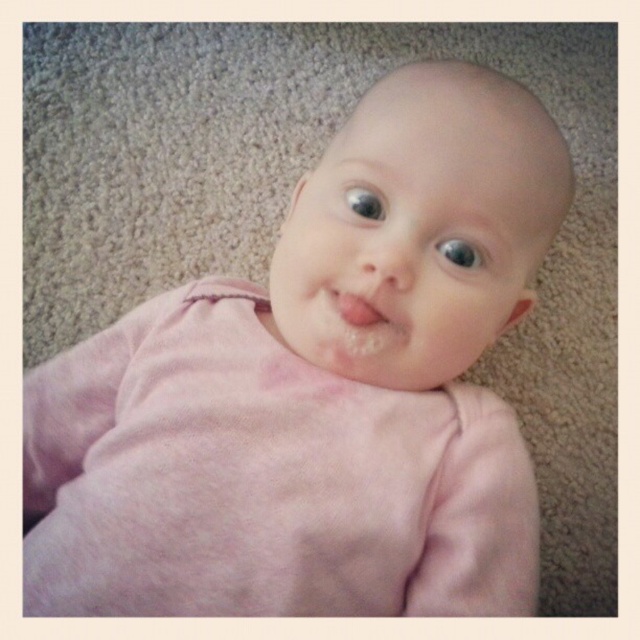
Does smooth pink baby at center come in front of blue glossy eye at upper center?

Yes, it is.

Does smooth pink baby at center appear on the left side of blue glossy eye at upper center?

In fact, smooth pink baby at center is to the right of blue glossy eye at upper center.

Describe the element at coordinates (413, 232) in the screenshot. I see `smooth pink baby at center` at that location.

The image size is (640, 640). Find the location of `smooth pink baby at center`. smooth pink baby at center is located at coordinates (413, 232).

Does pink matte lips at center have a larger size compared to blue glossy eye at upper center?

Correct, pink matte lips at center is larger in size than blue glossy eye at upper center.

Can you confirm if pink matte lips at center is positioned to the left of blue glossy eye at upper center?

Indeed, pink matte lips at center is positioned on the left side of blue glossy eye at upper center.

Is point (349, 323) positioned after point (369, 192)?

That is False.

I want to click on pink matte lips at center, so click(x=356, y=310).

Describe the element at coordinates (413, 232) in the screenshot. This screenshot has width=640, height=640. I see `smooth pink baby at center` at that location.

Measure the distance between smooth pink baby at center and camera.

smooth pink baby at center and camera are 49.75 centimeters apart from each other.

The height and width of the screenshot is (640, 640). What are the coordinates of `smooth pink baby at center` in the screenshot? It's located at (413, 232).